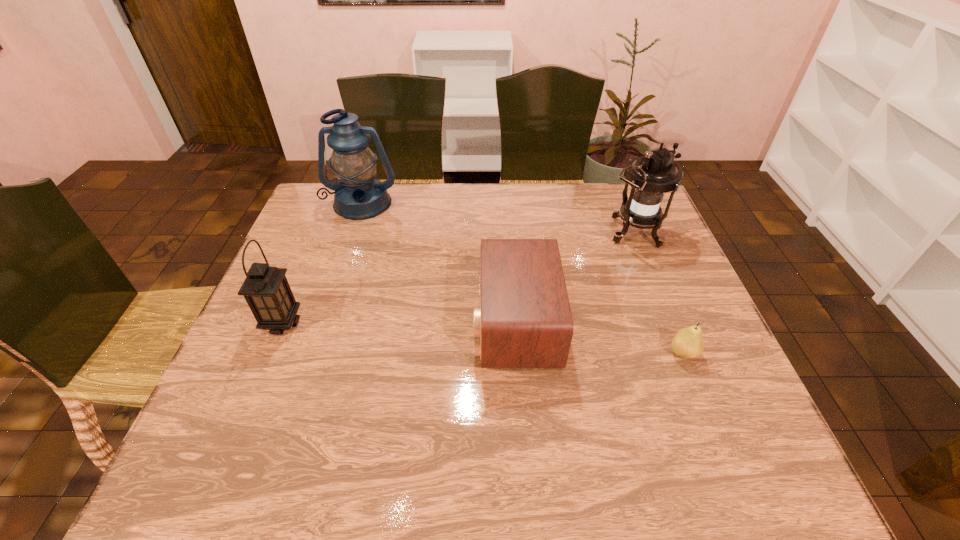
Locate an element on the screen. This screenshot has height=540, width=960. the rightmost lantern is located at coordinates (651, 176).

In order to click on the nearest lantern in this screenshot , I will do `click(266, 290)`.

This screenshot has height=540, width=960. I want to click on the shortest lantern, so click(266, 290).

Locate an element on the screen. This screenshot has width=960, height=540. the third object from right to left is located at coordinates (524, 321).

Locate an element on the screen. The width and height of the screenshot is (960, 540). the fourth tallest object is located at coordinates (524, 321).

Locate an element on the screen. The width and height of the screenshot is (960, 540). the shortest object is located at coordinates [687, 343].

Locate an element on the screen. free space located on the left of the rightmost lantern is located at coordinates (510, 234).

The image size is (960, 540). Identify the location of free space located on the front of the third shortest object. (246, 410).

I want to click on vacant space located 0.390m on the front panel of the radio receiver, so click(x=316, y=323).

Locate an element on the screen. vacant area located on the front panel of the radio receiver is located at coordinates (324, 323).